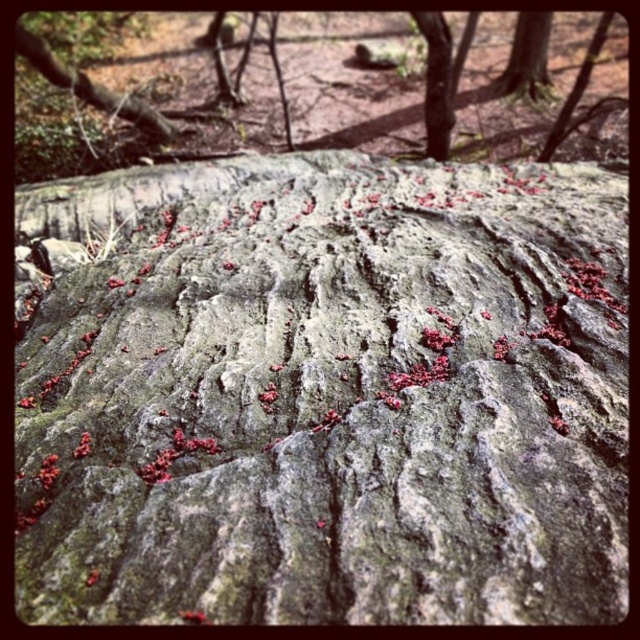
Question: Is rough bark tree trunk at center bigger than smooth bark tree trunk at upper center?

Choices:
 (A) no
 (B) yes

Answer: (B)

Question: Which point is farther to the camera?

Choices:
 (A) rough bark tree trunk at center
 (B) smooth bark tree trunk at upper center
 (C) green mossy rock at center

Answer: (A)

Question: Where is green mossy rock at center located in relation to rough bark tree trunk at center in the image?

Choices:
 (A) above
 (B) below

Answer: (B)

Question: Which point appears closest to the camera in this image?

Choices:
 (A) (227, 568)
 (B) (435, 90)

Answer: (A)

Question: Is green mossy rock at center in front of smooth bark tree trunk at upper center?

Choices:
 (A) no
 (B) yes

Answer: (B)

Question: Which point is closer to the camera?

Choices:
 (A) rough bark tree trunk at center
 (B) smooth bark tree trunk at upper center

Answer: (B)